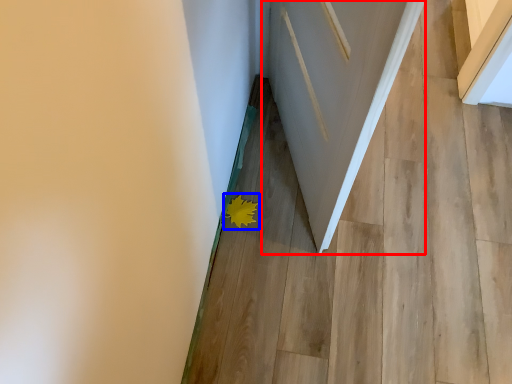
Question: Among these objects, which one is nearest to the camera, door (highlighted by a red box) or flower (highlighted by a blue box)?

Choices:
 (A) door
 (B) flower

Answer: (A)